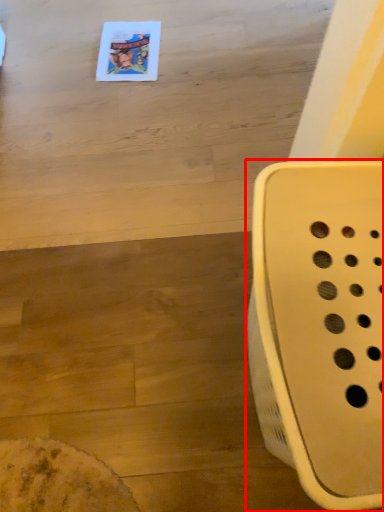
Question: In this image, where is furniture (annotated by the red box) located relative to table?

Choices:
 (A) left
 (B) right

Answer: (B)